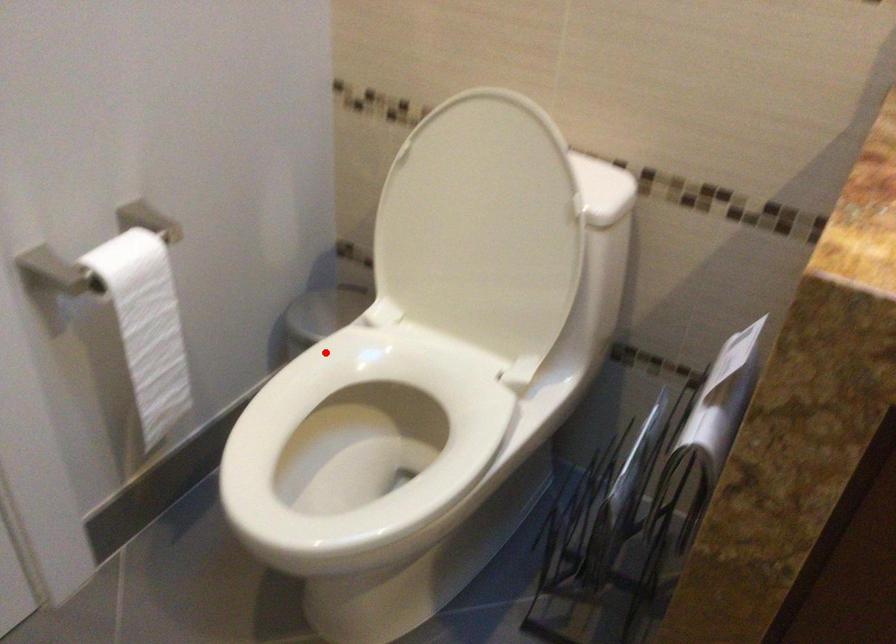
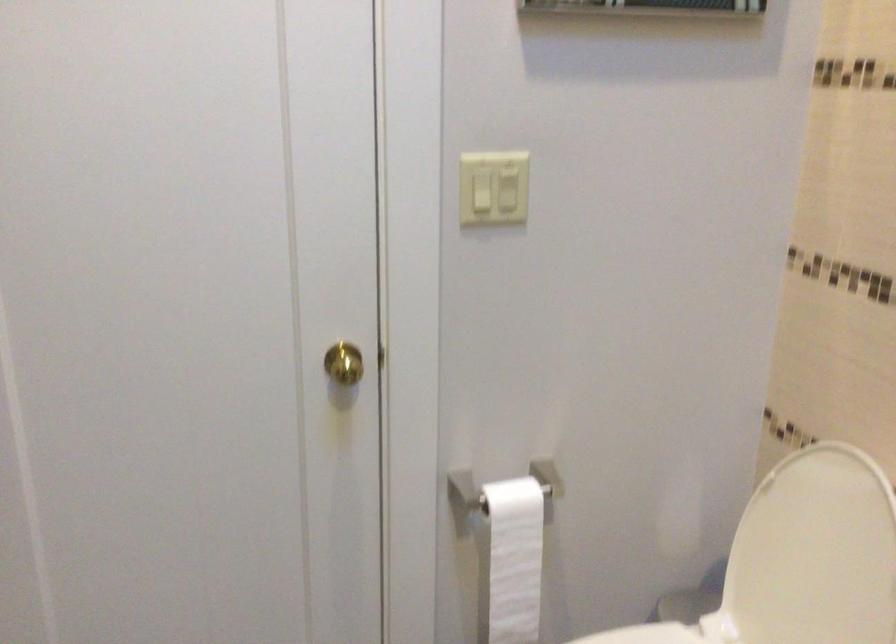
Question: A red point is marked in image1. In image2, is the corresponding 3D point closer to the camera or farther? Reply with the corresponding letter.

Choices:
 (A) The corresponding 3D point is closer.
 (B) The corresponding 3D point is farther.

Answer: (B)